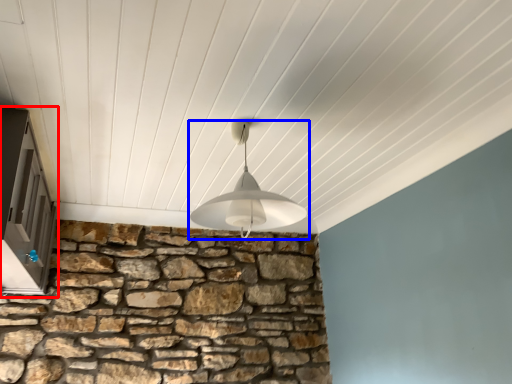
Question: Among these objects, which one is nearest to the camera, window (highlighted by a red box) or lamp (highlighted by a blue box)?

Choices:
 (A) window
 (B) lamp

Answer: (A)